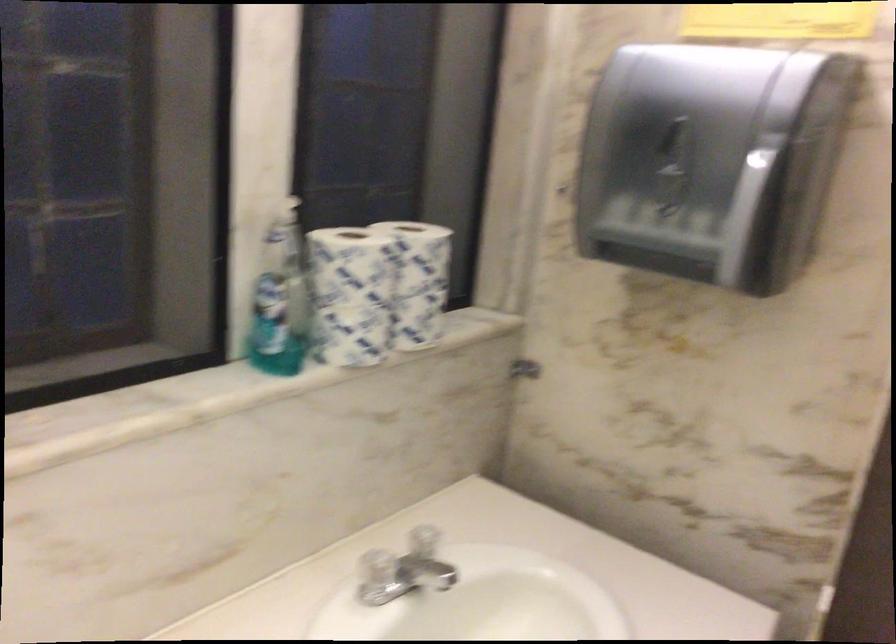
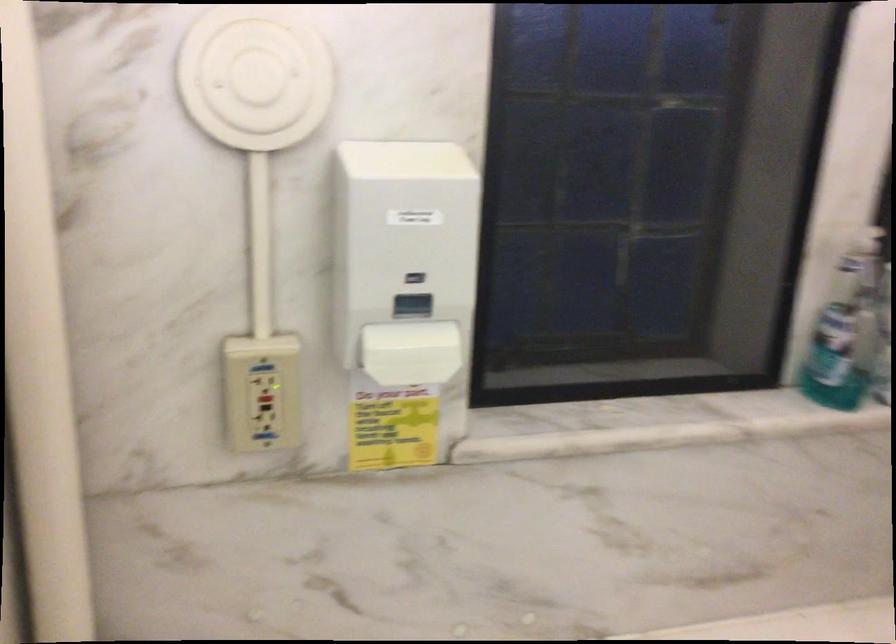
In the second image, find the point that corresponds to (x=278, y=308) in the first image.

(842, 339)